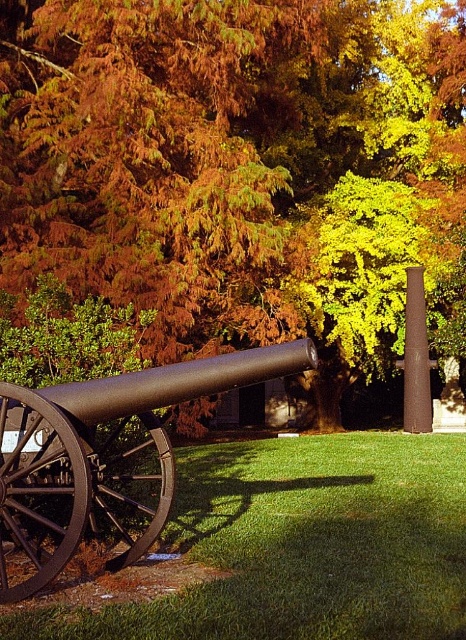
Question: Which point is closer to the camera?

Choices:
 (A) (293, 44)
 (B) (292, 588)
 (C) (19, 406)
 (D) (408, 333)

Answer: (B)

Question: Based on their relative distances, which object is farther from the matte black cannon at lower left?

Choices:
 (A) orange-brown foliage at center
 (B) rusty metal pole at center right
 (C) green grass at lower center

Answer: (B)

Question: Is orange-brown foliage at center to the left of matte black cannon at lower left from the viewer's perspective?

Choices:
 (A) no
 (B) yes

Answer: (A)

Question: Which of the following is the closest to the observer?

Choices:
 (A) (224, 499)
 (B) (409, 268)
 (C) (169, 365)
 (D) (232, 17)

Answer: (C)

Question: Does orange-brown foliage at center have a greater width compared to rusty metal pole at center right?

Choices:
 (A) yes
 (B) no

Answer: (A)

Question: Is green grass at lower center closer to camera compared to rusty metal pole at center right?

Choices:
 (A) yes
 (B) no

Answer: (A)